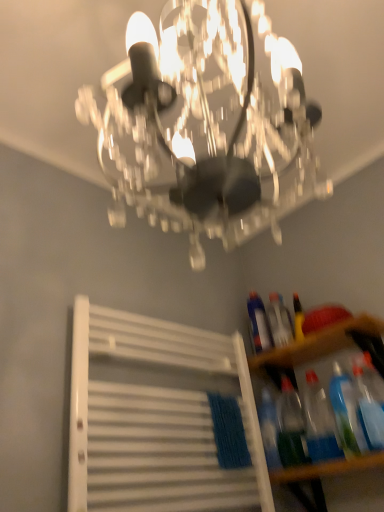
Question: Is transparent plastic bottles at lower right looking in the opposite direction of translucent plastic bottle at lower right, positioned as the 3th bottle in front-to-back order?

Choices:
 (A) yes
 (B) no

Answer: (B)

Question: From the image's perspective, would you say transparent plastic bottles at lower right is shown under translucent plastic bottle at lower right, positioned as the 3th bottle in front-to-back order?

Choices:
 (A) no
 (B) yes

Answer: (A)

Question: Does transparent plastic bottles at lower right have a lesser width compared to translucent plastic bottle at lower right, positioned as the 3th bottle in front-to-back order?

Choices:
 (A) no
 (B) yes

Answer: (A)

Question: From a real-world perspective, is transparent plastic bottles at lower right beneath translucent plastic bottle at lower right, marked as the 3th bottle in a back-to-front arrangement?

Choices:
 (A) no
 (B) yes

Answer: (A)

Question: Considering the relative sizes of transparent plastic bottles at lower right and translucent plastic bottle at lower right, positioned as the 3th bottle in front-to-back order, in the image provided, is transparent plastic bottles at lower right shorter than translucent plastic bottle at lower right, positioned as the 3th bottle in front-to-back order,?

Choices:
 (A) no
 (B) yes

Answer: (B)

Question: From the image's perspective, is translucent plastic bottle at right, which appears as the 2th bottle when viewed from the back, located above or below transparent plastic bottles at lower right?

Choices:
 (A) below
 (B) above

Answer: (B)

Question: Considering the positions of translucent plastic bottle at right, which appears as the 2th bottle when viewed from the back, and transparent plastic bottles at lower right in the image, is translucent plastic bottle at right, which appears as the 2th bottle when viewed from the back, wider or thinner than transparent plastic bottles at lower right?

Choices:
 (A) thin
 (B) wide

Answer: (A)

Question: Based on their positions, is translucent plastic bottle at right, which is the 4th bottle in front-to-back order, located to the left or right of transparent plastic bottles at lower right?

Choices:
 (A) left
 (B) right

Answer: (A)

Question: Considering the positions of point (278, 314) and point (369, 329), is point (278, 314) closer or farther from the camera than point (369, 329)?

Choices:
 (A) closer
 (B) farther

Answer: (B)

Question: In terms of width, does clear crystal chandelier at upper center look wider or thinner when compared to translucent plastic bottle at lower right, marked as the 3th bottle in a back-to-front arrangement?

Choices:
 (A) wide
 (B) thin

Answer: (A)

Question: From the image's perspective, is clear crystal chandelier at upper center located above or below translucent plastic bottle at lower right, marked as the 3th bottle in a back-to-front arrangement?

Choices:
 (A) above
 (B) below

Answer: (A)

Question: From a real-world perspective, is clear crystal chandelier at upper center physically located above or below translucent plastic bottle at lower right, marked as the 3th bottle in a back-to-front arrangement?

Choices:
 (A) below
 (B) above

Answer: (B)

Question: Considering the positions of clear crystal chandelier at upper center and translucent plastic bottle at lower right, positioned as the 3th bottle in front-to-back order, in the image, is clear crystal chandelier at upper center bigger or smaller than translucent plastic bottle at lower right, positioned as the 3th bottle in front-to-back order,?

Choices:
 (A) big
 (B) small

Answer: (A)

Question: Is translucent plastic bottle at lower right, marked as the 3th bottle in a back-to-front arrangement, in front of or behind transparent plastic bottles at lower right in the image?

Choices:
 (A) front
 (B) behind

Answer: (B)

Question: Based on their sizes in the image, would you say translucent plastic bottle at lower right, positioned as the 3th bottle in front-to-back order, is bigger or smaller than transparent plastic bottles at lower right?

Choices:
 (A) small
 (B) big

Answer: (A)